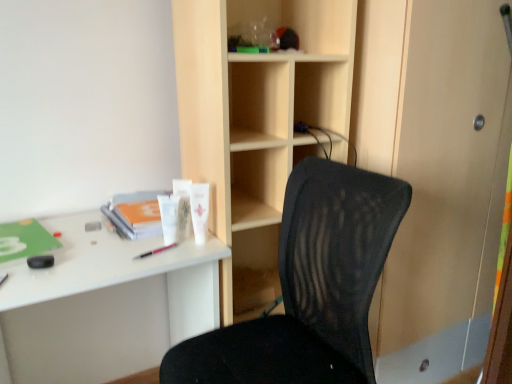
What are the coordinates of `vacant region to the right of pink plastic pen at center, acting as the 2th stationery starting from the right` in the screenshot? It's located at (199, 245).